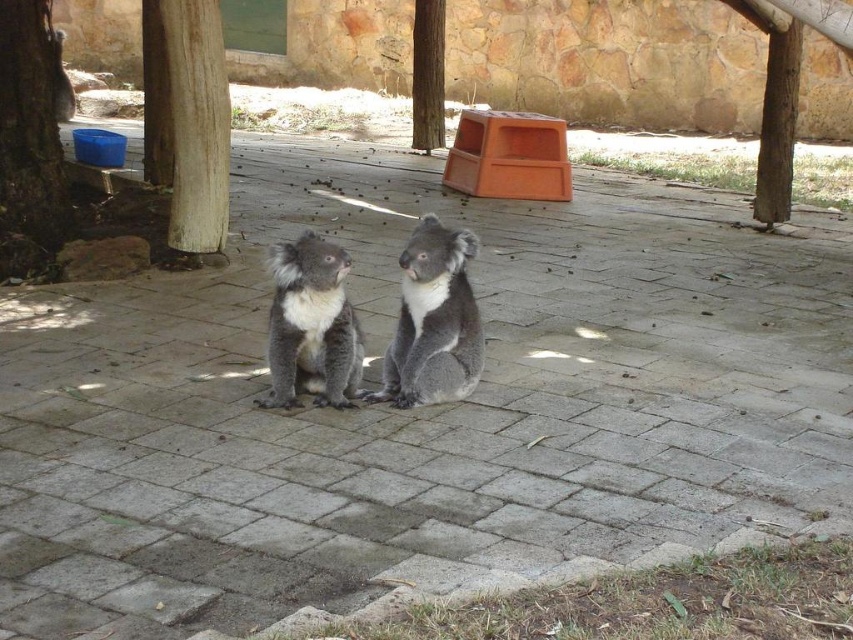
Question: Among these objects, which one is farthest from the camera?

Choices:
 (A) brown textured wood at left
 (B) gray furry koala at center
 (C) smooth brown tree trunk at center
 (D) fuzzy gray koala at upper center

Answer: (D)

Question: Can you confirm if gray furry koala at center is positioned to the left of brown rough wood at center?

Choices:
 (A) yes
 (B) no

Answer: (A)

Question: Does gray furry koala at center appear over brown rough wood at center?

Choices:
 (A) no
 (B) yes

Answer: (A)

Question: Can you confirm if brown rough wood at center is positioned to the left of fuzzy gray koala at upper center?

Choices:
 (A) yes
 (B) no

Answer: (B)

Question: Which object is positioned farthest from the fuzzy gray koala at center?

Choices:
 (A) smooth brown tree trunk at center
 (B) brown rough bark at left
 (C) fuzzy gray koala at upper center

Answer: (C)

Question: Which object is the closest to the fuzzy gray koala at center?

Choices:
 (A) brown rough wood at center
 (B) fuzzy gray koala at upper center
 (C) brown textured wood at left

Answer: (C)